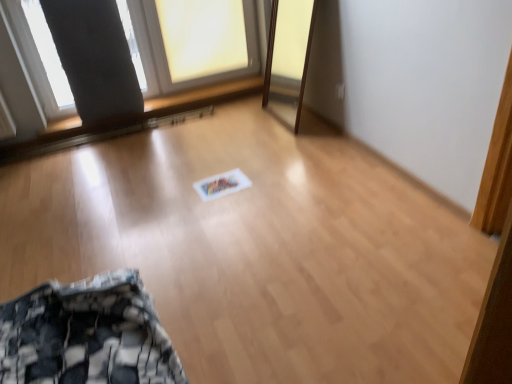
This screenshot has width=512, height=384. What do you see at coordinates (165, 52) in the screenshot?
I see `matte gray curtain at upper left` at bounding box center [165, 52].

Where is `matte gray curtain at upper left`? This screenshot has height=384, width=512. matte gray curtain at upper left is located at coordinates (165, 52).

Where is `matte gray curtain at upper left`? matte gray curtain at upper left is located at coordinates (165, 52).